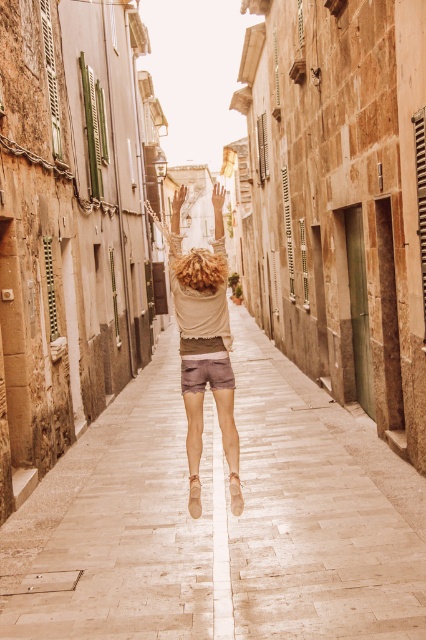
Question: Among these points, which one is farthest from the camera?

Choices:
 (A) (187, 314)
 (B) (236, 323)

Answer: (B)

Question: Observing the image, what is the correct spatial positioning of smooth stone pavement at center in reference to beige cotton shorts at center?

Choices:
 (A) left
 (B) right

Answer: (B)

Question: Which point appears farthest from the camera in this image?

Choices:
 (A) (226, 452)
 (B) (278, 589)

Answer: (A)

Question: Is the position of smooth stone pavement at center less distant than that of beige cotton shorts at center?

Choices:
 (A) yes
 (B) no

Answer: (A)

Question: Is smooth stone pavement at center smaller than beige cotton shorts at center?

Choices:
 (A) no
 (B) yes

Answer: (A)